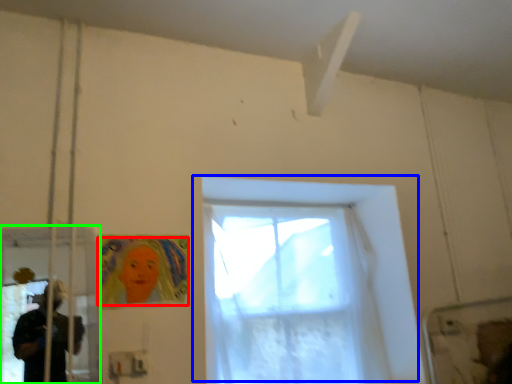
Question: Considering the real-world distances, which object is farthest from woman (highlighted by a red box)? window (highlighted by a blue box) or screen door (highlighted by a green box)?

Choices:
 (A) window
 (B) screen door

Answer: (A)